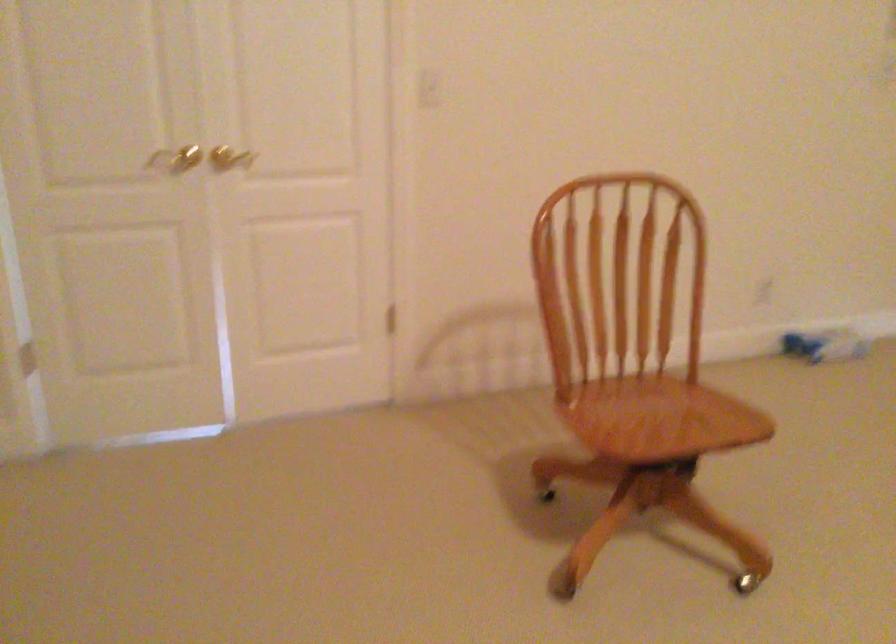
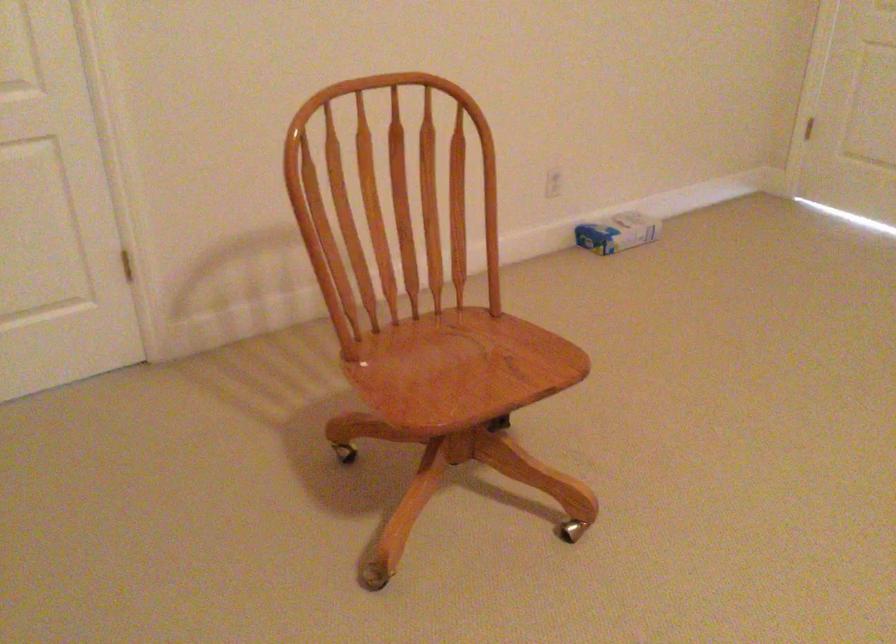
The point at (625, 420) is marked in the first image. Where is the corresponding point in the second image?

(428, 374)